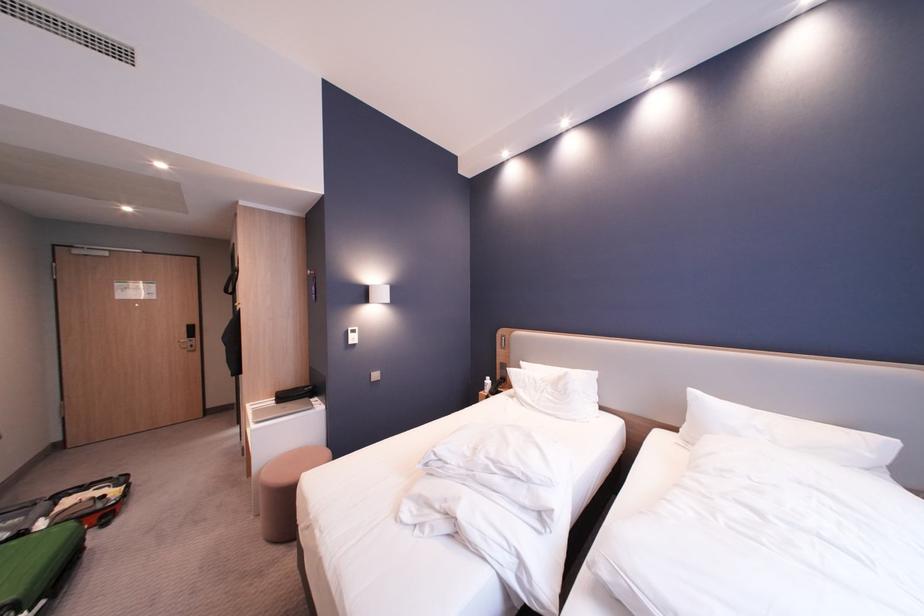
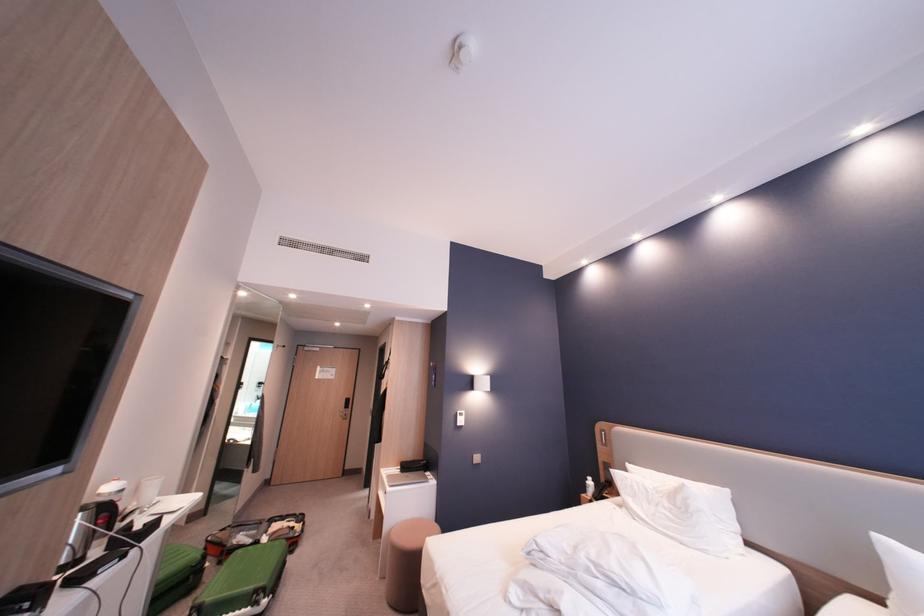
The first image is from the beginning of the video and the second image is from the end. How did the camera likely rotate when shooting the video?

The camera rotated toward left-up.